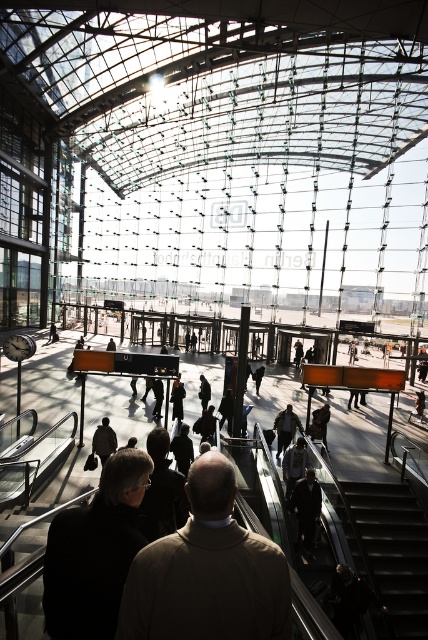
Question: Which point is closer to the camera?

Choices:
 (A) dark gray sweater at center
 (B) black matte jacket at lower left
 (C) dark brown leather jacket at lower left

Answer: (B)

Question: Considering the real-world distances, which object is closest to the light brown leather jacket at center?

Choices:
 (A) black metal escalator at lower right
 (B) dark brown leather jacket at lower left
 (C) black matte jacket at lower left
 (D) dark gray suit at center

Answer: (C)

Question: Considering the real-world distances, which object is closest to the black metal escalator at lower right?

Choices:
 (A) dark brown leather jacket at lower left
 (B) black matte jacket at lower left
 (C) dark gray sweater at center

Answer: (C)

Question: Can you confirm if dark gray suit at center is positioned to the right of dark gray jacket at center?

Choices:
 (A) no
 (B) yes

Answer: (A)

Question: Is light brown leather jacket at center below black metal escalator at lower right?

Choices:
 (A) yes
 (B) no

Answer: (B)

Question: Observing the image, what is the correct spatial positioning of light brown leather jacket at center in reference to dark gray suit at center?

Choices:
 (A) left
 (B) right

Answer: (A)